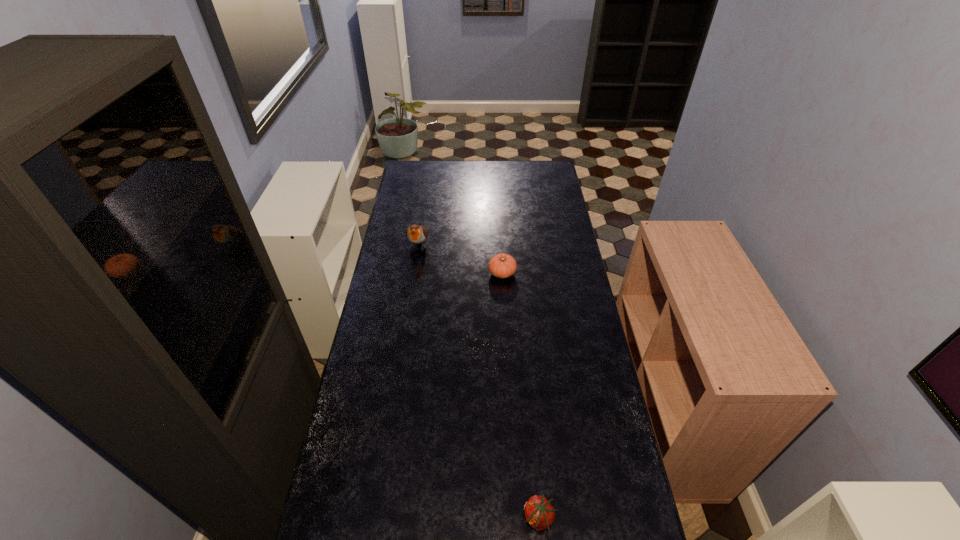
You are a GUI agent. You are given a task and a screenshot of the screen. Output one action in this format:
    pyautogui.click(x=<x>, y=<y>)
    Task: Click on the vacant area in the image that satisfies the following two spatial constraints: 1. at the face of the shorter tomato; 2. on the right side of the leftmost object
    
    Given the screenshot: What is the action you would take?
    pyautogui.click(x=376, y=518)

You are a GUI agent. You are given a task and a screenshot of the screen. Output one action in this format:
    pyautogui.click(x=<x>, y=<y>)
    Task: Click on the vacant space that satisfies the following two spatial constraints: 1. at the face of the leftmost object; 2. on the left side of the farther tomato
    Image resolution: width=960 pixels, height=540 pixels.
    Given the screenshot: What is the action you would take?
    414,273

This screenshot has height=540, width=960. I want to click on free point that satisfies the following two spatial constraints: 1. at the face of the shortest object; 2. on the right side of the leftmost object, so click(376, 518).

At what (x,y) coordinates should I click in order to perform the action: click on vacant space that satisfies the following two spatial constraints: 1. on the front side of the second tallest object; 2. on the left side of the shorter tomato. Please return your answer as a coordinate pair (x, y). Looking at the image, I should click on (516, 518).

At what (x,y) coordinates should I click in order to perform the action: click on free point that satisfies the following two spatial constraints: 1. at the face of the shortest object; 2. on the right side of the tallest object. Please return your answer as a coordinate pair (x, y). This screenshot has width=960, height=540. Looking at the image, I should click on (376, 518).

The height and width of the screenshot is (540, 960). I want to click on free spot that satisfies the following two spatial constraints: 1. on the front side of the nearer tomato; 2. on the right side of the second tallest object, so click(x=516, y=518).